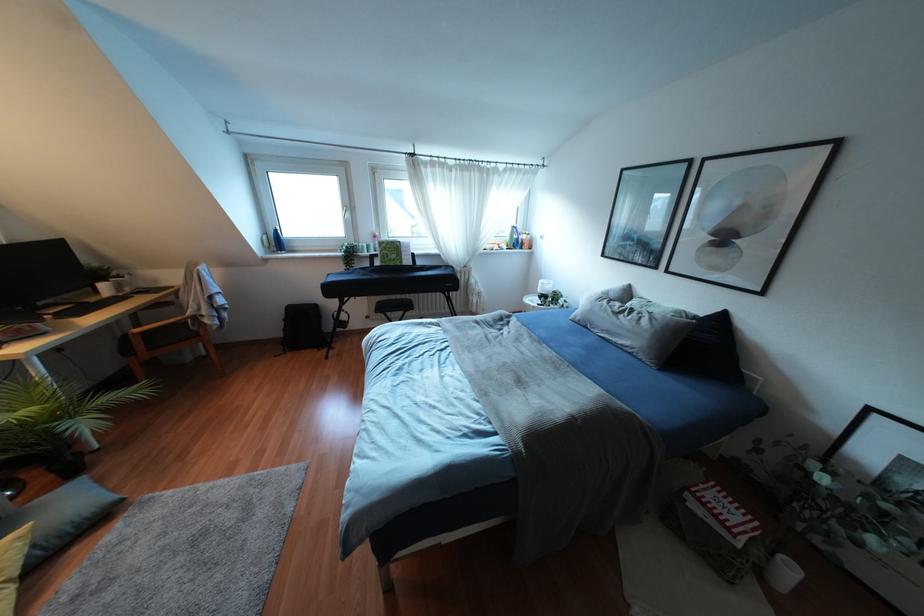
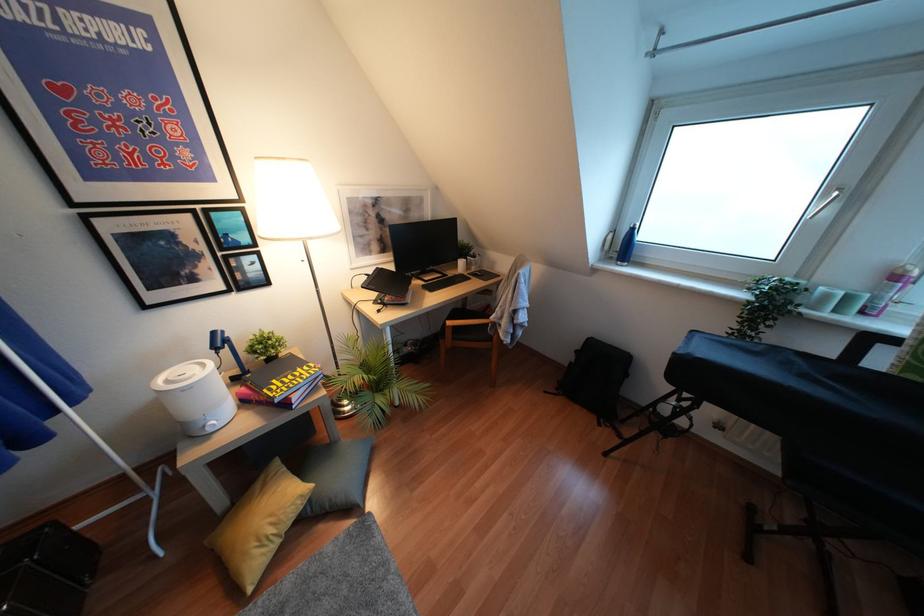
The point at (275, 241) is marked in the first image. Where is the corresponding point in the second image?

(623, 246)